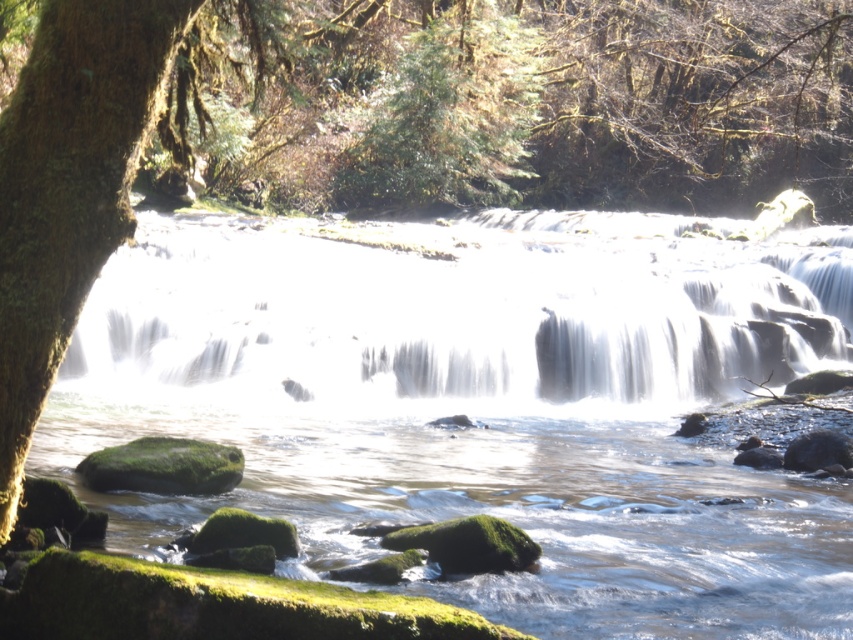
You are standing at the edge of the river and want to cross to the other side. The clear water at center is located at point (x=482, y=404). Can you step on the clear water at center to cross the river?

The clear water at center is located at point (x=482, y=404), so stepping on it would not be possible since water is not solid ground and cannot support your weight.